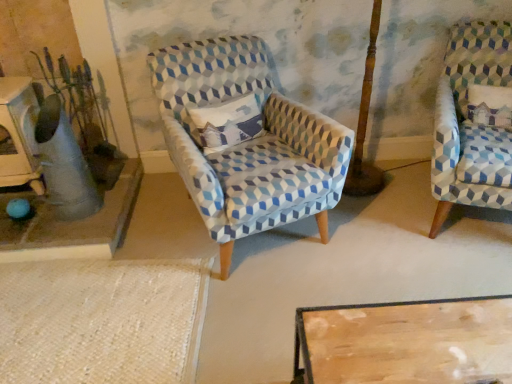
The width and height of the screenshot is (512, 384). I want to click on free space to the left of blue-patterned fabric chair at right, positioned as the first chair in right-to-left order, so click(x=378, y=240).